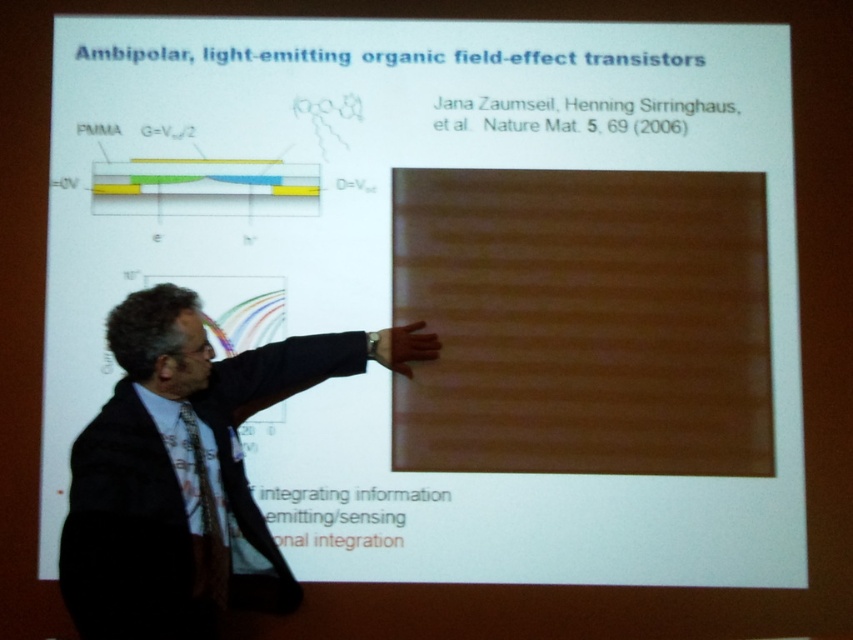
You are an attendee at the presentation and want to know which of the two points on the slide is closer to you. The points are labeled as point at position (x=90, y=499) and point at position (x=202, y=577). Which one is closer?

The point at position (x=90, y=499) is closer to the viewer than the point at position (x=202, y=577).

You are an assistant at a conference, and you need to ensure that all presenters are visible on the camera feed. The camera is focused on the dark suit at center and black textured tie at center. Which object should you adjust the camera to focus on to capture the presenter from head to toe?

The dark suit at center is much taller than the black textured tie at center, so the camera should be adjusted to focus on the dark suit at center to ensure the presenter is captured from head to toe.

You are an assistant helping to prepare for a presentation. You have to place a name tag on the presenter. The name tag is 10 cm wide. The dark suit at center is 50 cm wide, and the black textured tie at center is 20 cm wide. Which item should you place the name tag on to ensure it is visible and centered?

The name tag should be placed on the dark suit at center since its width of 50 cm is larger than the black textured tie at center, providing enough space for visibility and proper centering.